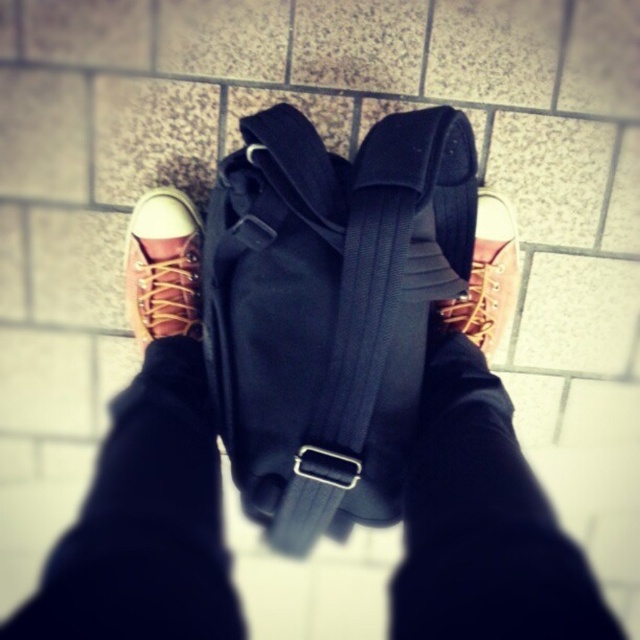
Question: Does matte black backpack at center appear under black fabric backpack at center?

Choices:
 (A) yes
 (B) no

Answer: (A)

Question: Considering the real-world distances, which object is closest to the matte black backpack at center?

Choices:
 (A) black fabric backpack at center
 (B) matte brown canvas shoe at center

Answer: (A)

Question: Which of the following is the closest to the observer?

Choices:
 (A) black fabric backpack at center
 (B) matte brown canvas shoe at center

Answer: (A)

Question: Does matte black backpack at center lie behind matte brown canvas shoe at center?

Choices:
 (A) yes
 (B) no

Answer: (B)

Question: Is matte black backpack at center to the right of matte brown canvas shoe at center from the viewer's perspective?

Choices:
 (A) no
 (B) yes

Answer: (B)

Question: Which of the following is the farthest from the observer?

Choices:
 (A) matte black backpack at center
 (B) black fabric backpack at center

Answer: (B)